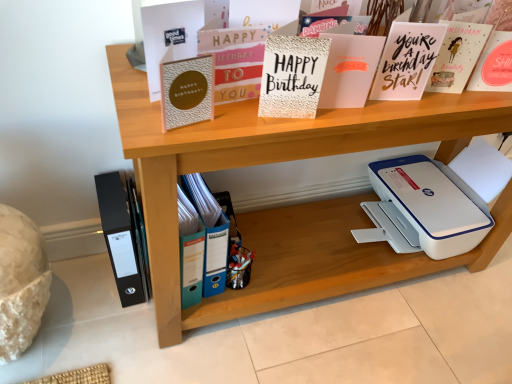
Question: Is textured gold card at center, which ranks as the fourth paperback book in left-to-right order, shorter than matte pink card at upper right, positioned as the seventh paperback book in left-to-right order?

Choices:
 (A) yes
 (B) no

Answer: (A)

Question: From the image's perspective, does textured gold card at center, which ranks as the fourth paperback book in left-to-right order, appear lower than matte pink card at upper right, placed as the 1th paperback book when sorted from right to left?

Choices:
 (A) yes
 (B) no

Answer: (A)

Question: Can you confirm if textured gold card at center, which appears as the 4th paperback book when viewed from the right, is bigger than matte pink card at upper right, positioned as the seventh paperback book in left-to-right order?

Choices:
 (A) yes
 (B) no

Answer: (A)

Question: From the image's perspective, would you say textured gold card at center, which appears as the 4th paperback book when viewed from the right, is positioned over matte pink card at upper right, positioned as the seventh paperback book in left-to-right order?

Choices:
 (A) yes
 (B) no

Answer: (B)

Question: Is textured gold card at center, which appears as the 4th paperback book when viewed from the right, at the left side of matte pink card at upper right, placed as the 1th paperback book when sorted from right to left?

Choices:
 (A) yes
 (B) no

Answer: (A)

Question: In the image, is matte gold card at upper center, which appears as the 6th paperback book when viewed from the left, positioned in front of or behind blue plastic file at lower center?

Choices:
 (A) front
 (B) behind

Answer: (A)

Question: Is point (415, 38) positioned closer to the camera than point (220, 228)?

Choices:
 (A) closer
 (B) farther

Answer: (A)

Question: Is matte gold card at upper center, which appears as the 6th paperback book when viewed from the left, taller or shorter than blue plastic file at lower center?

Choices:
 (A) tall
 (B) short

Answer: (B)

Question: Considering the positions of matte gold card at upper center, which appears as the 6th paperback book when viewed from the left, and blue plastic file at lower center in the image, is matte gold card at upper center, which appears as the 6th paperback book when viewed from the left, bigger or smaller than blue plastic file at lower center?

Choices:
 (A) big
 (B) small

Answer: (B)

Question: Does point (188, 271) appear closer or farther from the camera than point (126, 231)?

Choices:
 (A) closer
 (B) farther

Answer: (A)

Question: Considering the relative positions of blue plastic ring binder at center, the seventh paperback book positioned from the right, and black matte folder at lower left in the image provided, is blue plastic ring binder at center, the seventh paperback book positioned from the right, to the left or to the right of black matte folder at lower left?

Choices:
 (A) left
 (B) right

Answer: (B)

Question: From a real-world perspective, is blue plastic ring binder at center, the seventh paperback book positioned from the right, physically located above or below black matte folder at lower left?

Choices:
 (A) below
 (B) above

Answer: (B)

Question: Considering the positions of blue plastic ring binder at center, the first paperback book from the left, and black matte folder at lower left in the image, is blue plastic ring binder at center, the first paperback book from the left, taller or shorter than black matte folder at lower left?

Choices:
 (A) tall
 (B) short

Answer: (B)

Question: Does point (240, 258) appear closer or farther from the camera than point (169, 92)?

Choices:
 (A) closer
 (B) farther

Answer: (B)

Question: Looking at the image, does metallic pen holder at center seem bigger or smaller compared to gold textured card at upper center, which is the sixth paperback book from right to left?

Choices:
 (A) big
 (B) small

Answer: (B)